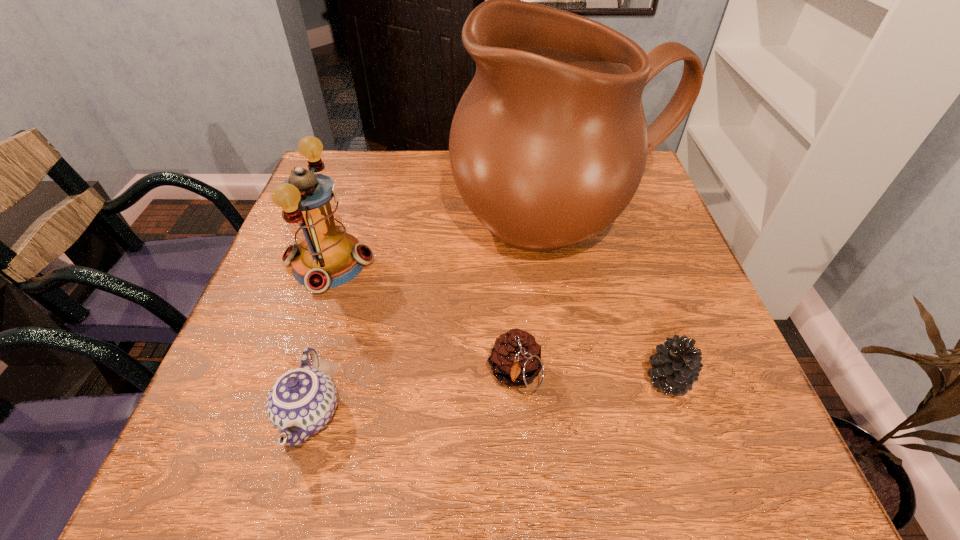
Find the location of a particular element. The image size is (960, 540). vacant space at the right edge of the desktop is located at coordinates (638, 234).

Where is `vacant position at the far left corner of the desktop`? vacant position at the far left corner of the desktop is located at coordinates (366, 181).

I want to click on free space at the near left corner of the desktop, so click(202, 482).

At what (x,y) coordinates should I click in order to perform the action: click on free space at the near right corner of the desktop. Please return your answer as a coordinate pair (x, y). Looking at the image, I should click on (766, 487).

In order to click on empty space that is in between the cream pitcher and the lantern in this screenshot , I will do `click(445, 243)`.

Find the location of a particular element. empty location between the cream pitcher and the right pinecone is located at coordinates (614, 301).

Locate an element on the screen. vacant point located between the chinaware and the left pinecone is located at coordinates (413, 394).

I want to click on empty space that is in between the cream pitcher and the left pinecone, so click(x=539, y=299).

The image size is (960, 540). Identify the location of vacant area between the right pinecone and the second tallest object. point(499,321).

Identify the location of vacant area between the chinaware and the left pinecone. (413, 394).